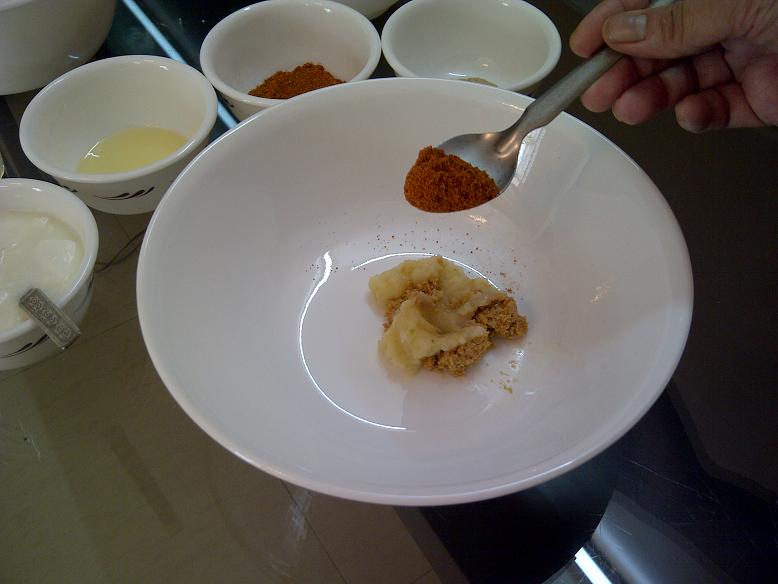
Locate an element on the screen. The image size is (778, 584). bowl is located at coordinates (188, 329), (76, 242), (111, 169), (268, 77), (461, 62).